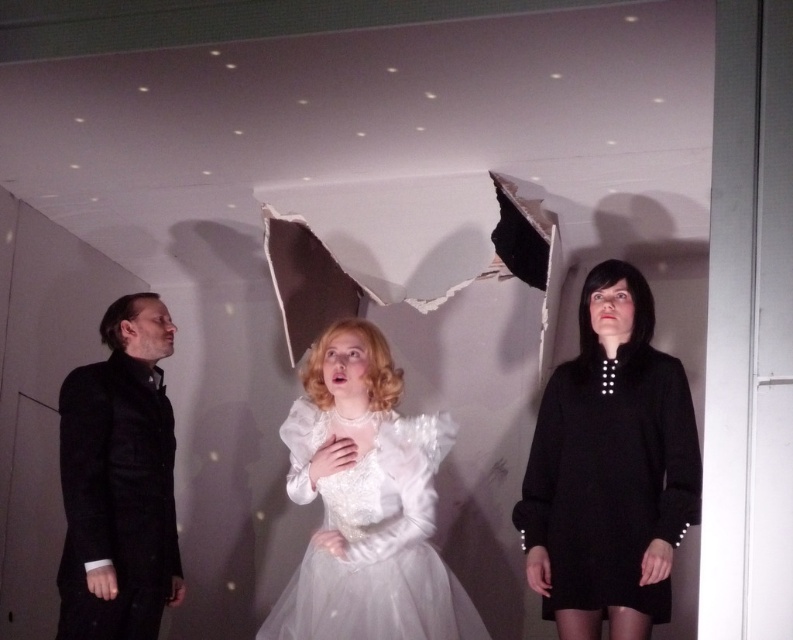
Is point (642, 406) less distant than point (156, 593)?

Yes, it is in front of point (156, 593).

Can you confirm if black matte dress at right is positioned below black matte suit at left?

Actually, black matte dress at right is above black matte suit at left.

Does point (688, 520) come closer to viewer compared to point (136, 502)?

Yes, it is in front of point (136, 502).

Where is `black matte dress at right`? The width and height of the screenshot is (793, 640). black matte dress at right is located at coordinates (610, 468).

Locate an element on the screen. This screenshot has width=793, height=640. black matte suit at left is located at coordinates (119, 481).

Can you confirm if black matte suit at left is positioned above white tulle dress at center?

Indeed, black matte suit at left is positioned over white tulle dress at center.

Locate an element on the screen. black matte suit at left is located at coordinates (119, 481).

Where is `black matte suit at left`? The image size is (793, 640). black matte suit at left is located at coordinates (119, 481).

Is black matte dress at right wider than white tulle dress at center?

In fact, black matte dress at right might be narrower than white tulle dress at center.

Does black matte dress at right appear on the left side of white tulle dress at center?

Incorrect, black matte dress at right is not on the left side of white tulle dress at center.

Which is behind, point (667, 563) or point (382, 604)?

The point (382, 604) is behind.

Locate an element on the screen. black matte dress at right is located at coordinates (610, 468).